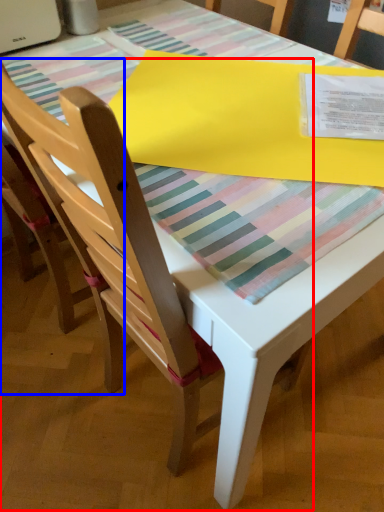
Question: Which of the following is the closest to the observer, chair (highlighted by a red box) or chair (highlighted by a blue box)?

Choices:
 (A) chair
 (B) chair

Answer: (A)